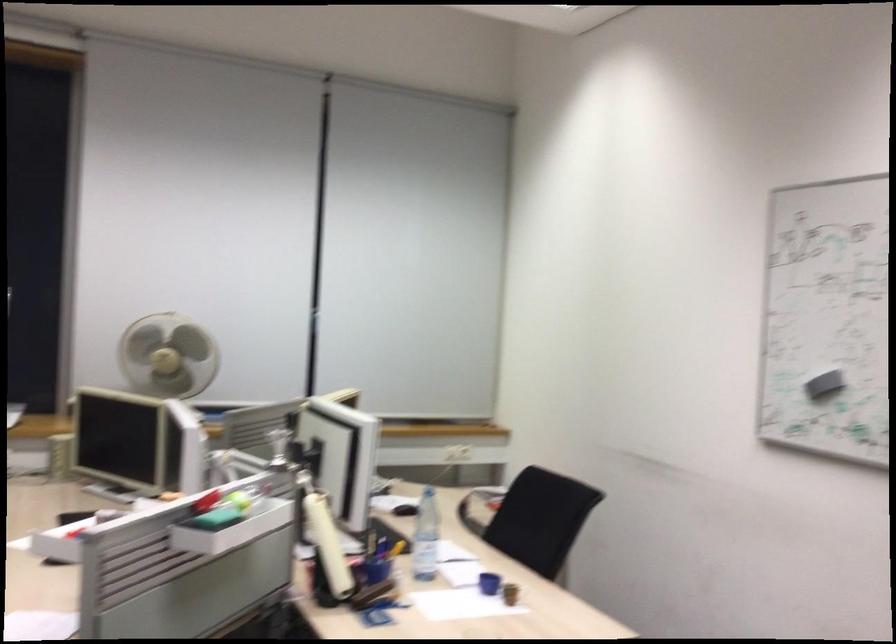
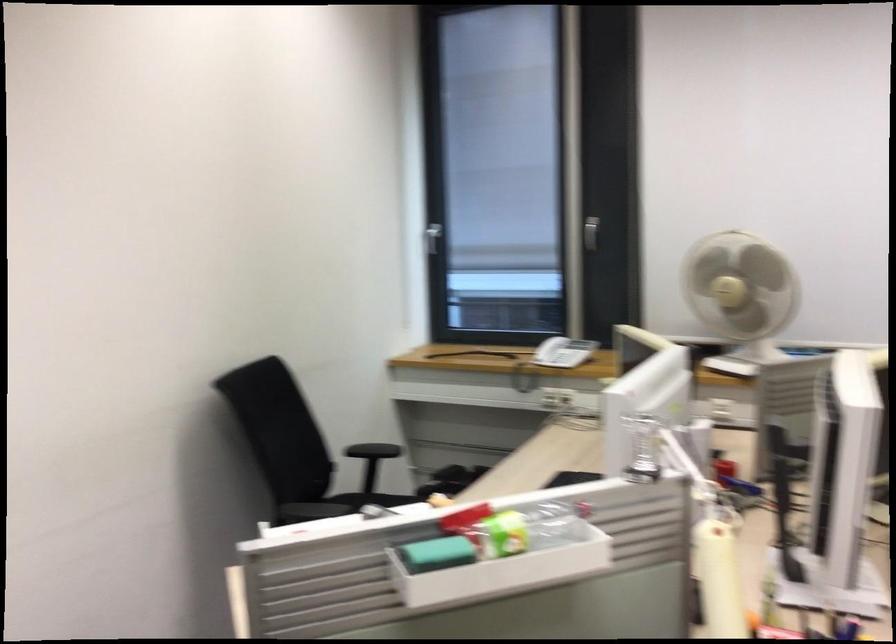
Where in the second image is the point corresponding to (x=209, y=526) from the first image?

(436, 554)